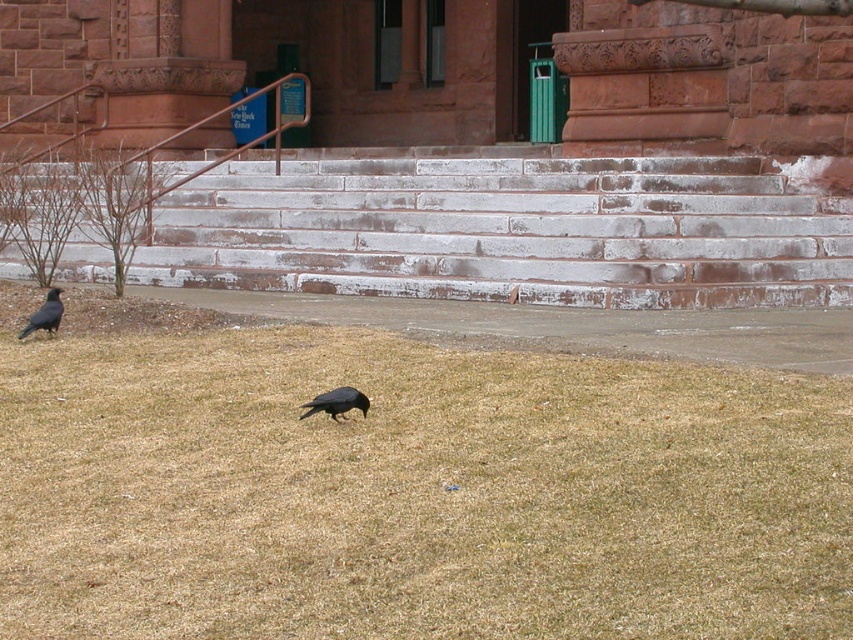
You are standing at the bottom of the stone steps leading to the building. You notice the brown dry grass at lower center and the matte black bird at lower left. Which object is closer to the base of the steps?

The brown dry grass at lower center is closer to the base of the steps because it is located below the matte black bird at lower left, indicating it is positioned lower in the scene.